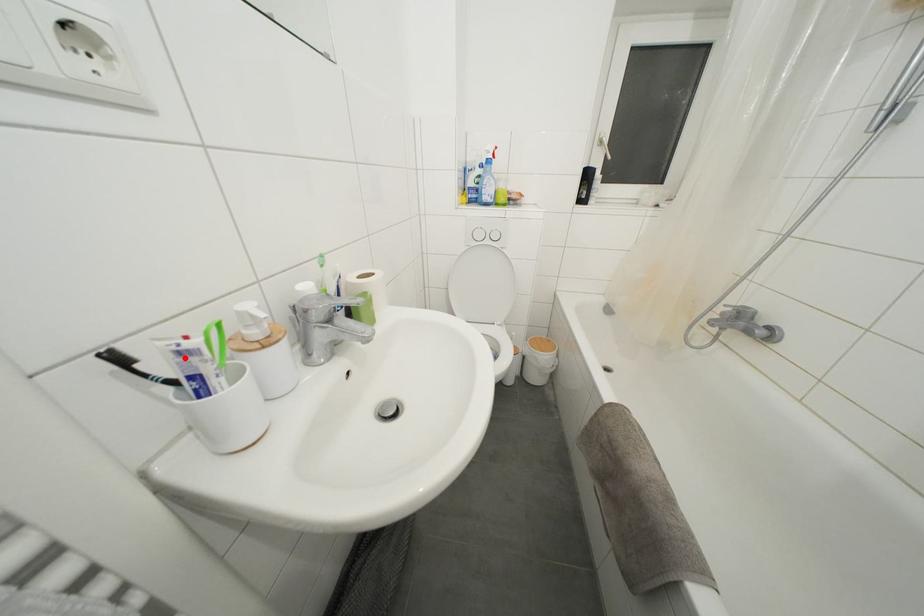
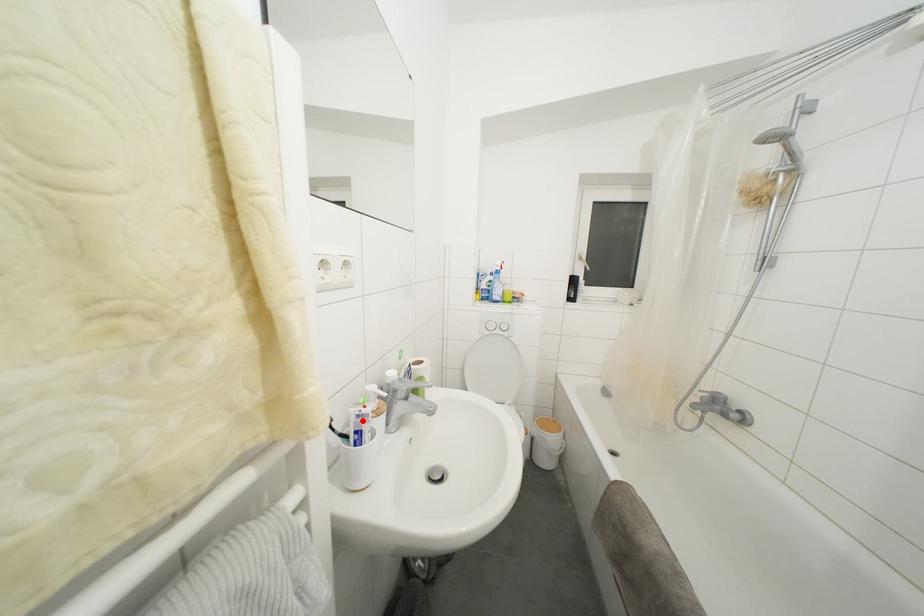
I am providing you with two images of the same scene from different viewpoints. A red point is marked on the first image and another point is marked on the second image. Does the point marked in image1 correspond to the same location as the one in image2?

Yes